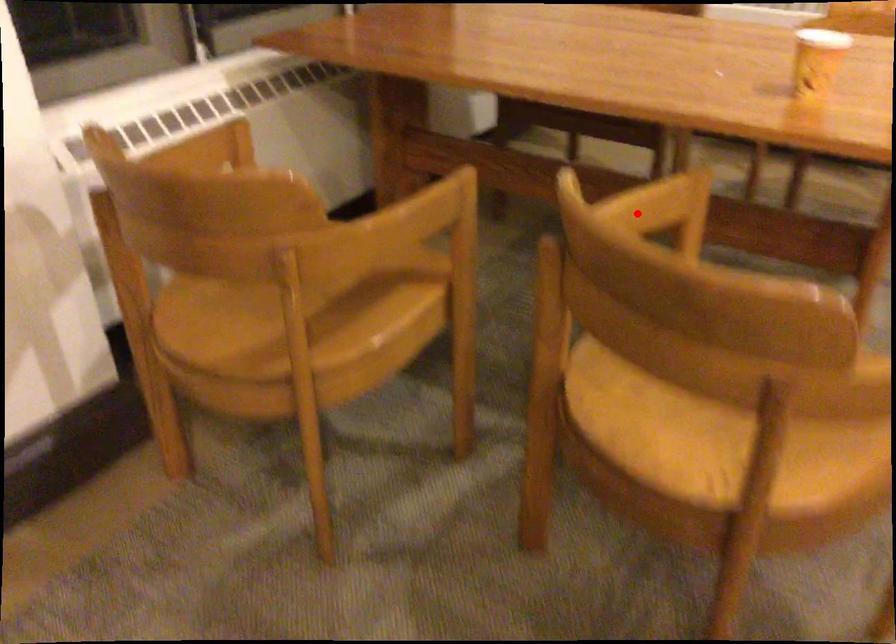
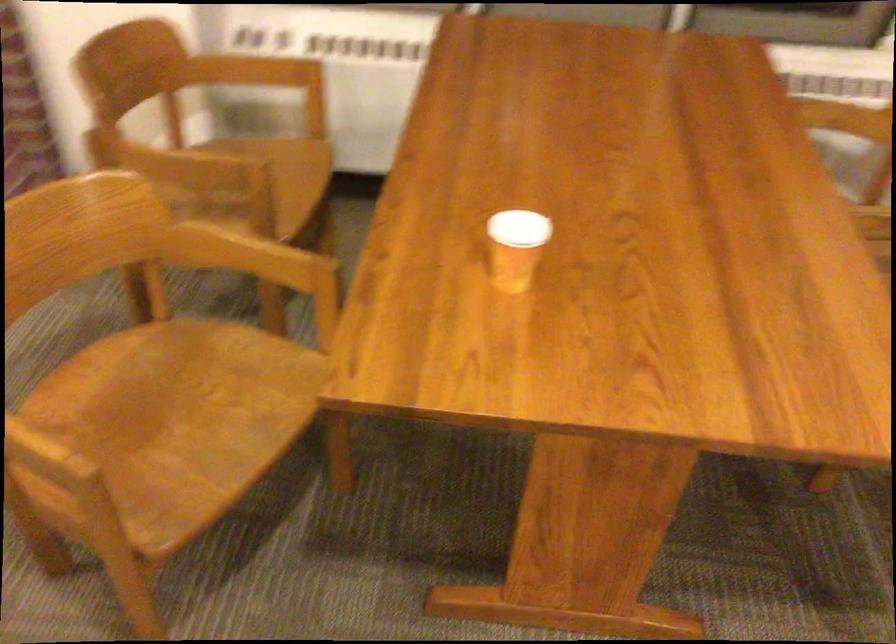
Question: I am providing you with two images of the same scene from different viewpoints. Given a red point in image1, look at the same physical point in image2. Is it:

Choices:
 (A) Closer to the viewpoint
 (B) Farther from the viewpoint

Answer: (B)